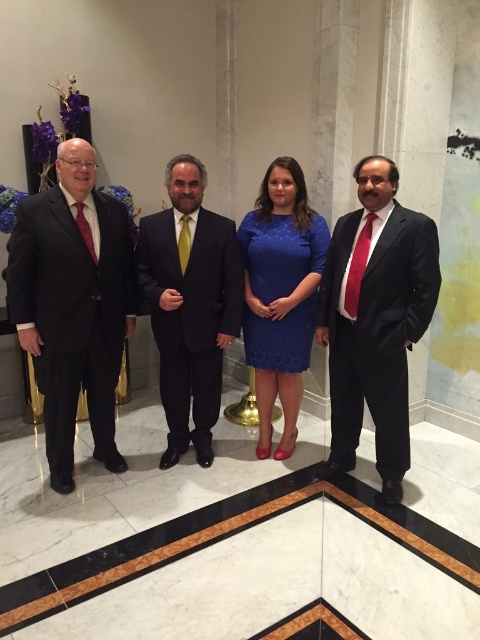
Which is below, matte black suit at left or blue textured dress at center?

matte black suit at left is below.

Looking at this image, can you confirm if matte black suit at left is positioned to the right of blue textured dress at center?

In fact, matte black suit at left is to the left of blue textured dress at center.

The height and width of the screenshot is (640, 480). What do you see at coordinates (73, 304) in the screenshot?
I see `matte black suit at left` at bounding box center [73, 304].

This screenshot has width=480, height=640. I want to click on matte black suit at left, so click(x=73, y=304).

Is point (36, 323) positioned behind point (369, 209)?

That is True.

Is matte black suit at left bigger than shiny black suit at right?

Indeed, matte black suit at left has a larger size compared to shiny black suit at right.

Image resolution: width=480 pixels, height=640 pixels. I want to click on matte black suit at left, so 73,304.

Find the location of a particular element. The image size is (480, 640). matte black suit at left is located at coordinates (73, 304).

Is point (149, 289) behind point (274, 348)?

No, (149, 289) is in front of (274, 348).

Is shiny dark suit at center further to camera compared to blue textured dress at center?

No, shiny dark suit at center is in front of blue textured dress at center.

Where is `shiny dark suit at center`? shiny dark suit at center is located at coordinates (190, 305).

At what (x,y) coordinates should I click in order to perform the action: click on shiny dark suit at center. Please return your answer as a coordinate pair (x, y). Looking at the image, I should click on (190, 305).